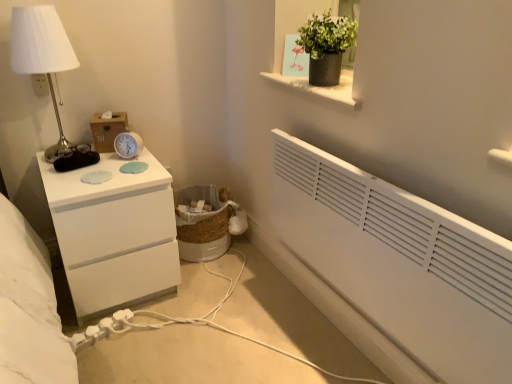
Identify the location of vacant area that is in front of white metallic table lamp at left. (64, 182).